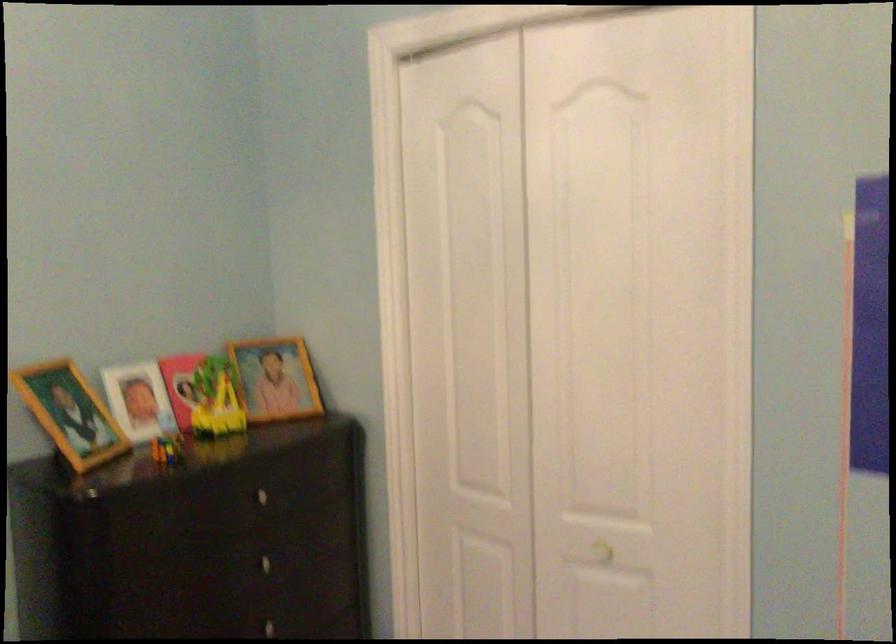
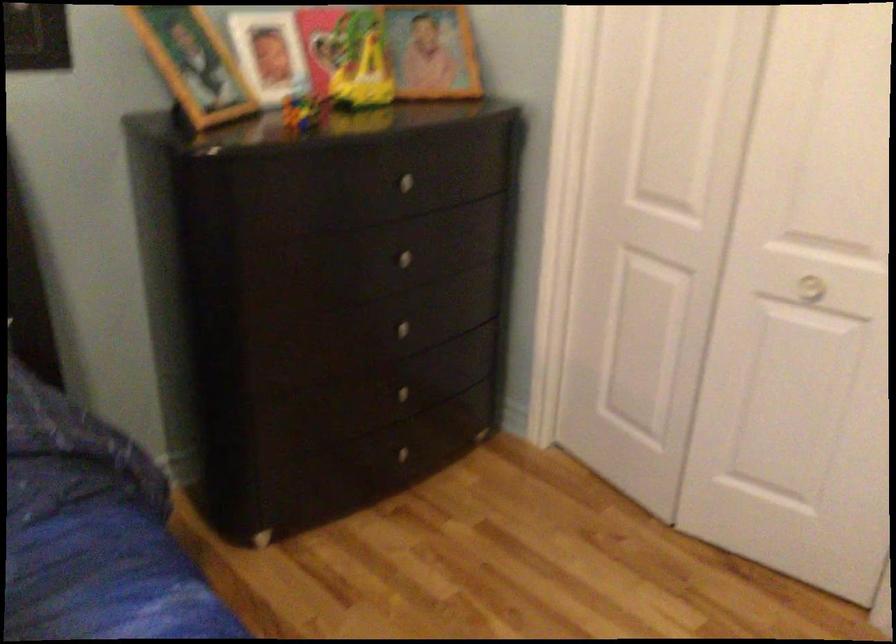
Find the pixel in the second image that matches the point at 259,564 in the first image.

(399, 258)